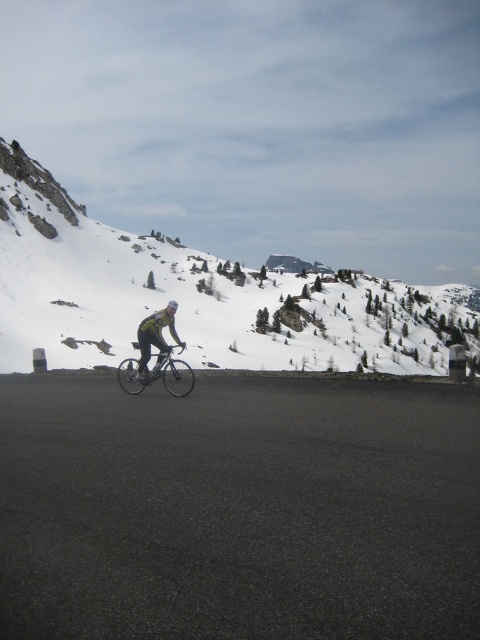
You are a cyclist planning to ride along the road in the mountainous region shown. You notice two points marked on the road ahead of you. One is at coordinates point (20, 269) and the other is at point (172, 310). Which point is closer to your current position?

Point (20, 269) is further to the camera than point (172, 310), so the point closer to your current position is point (172, 310).

You are a photographer trying to capture the cyclist in the scene. You want to ensure the shiny silver bicycle at center and the yellow matte helmet at center are both visible in your shot. Based on their positions, which object should you focus on first to frame them properly?

The shiny silver bicycle at center is to the right of the yellow matte helmet at center. To frame both properly, focus on the yellow matte helmet at center first since it is on the left side, ensuring there is space to include the bicycle to its right in the frame.

You are a photographer planning to capture the snowy rocky mountain at upper center and the yellow matte helmet at center in a single frame. Which object will occupy more of the horizontal space in your photo?

The snowy rocky mountain at upper center will occupy more horizontal space in the photo because its width is larger than that of the yellow matte helmet at center.